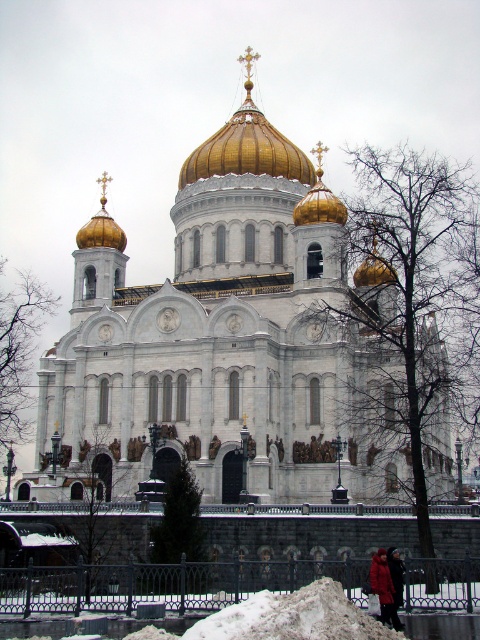
You are standing in front of the cathedral and want to take a photo that includes the white marble church at center. Where should you position yourself to ensure the church is centered in your shot?

To center the white marble church at center in your photo, position yourself directly in front of the church at the coordinates corresponding to its central point, which is at location 0.534 on the x and 0.463 on the y axis.

You are standing in front of the cathedral and want to take a photo that includes the entire white marble church at center. Given that your camera can capture a maximum distance of 60 meters, will you be able to capture the entire church in your photo?

The white marble church at center is 59.83 meters from camera, so yes, the camera can capture the entire church as it is within the 60 meters range.